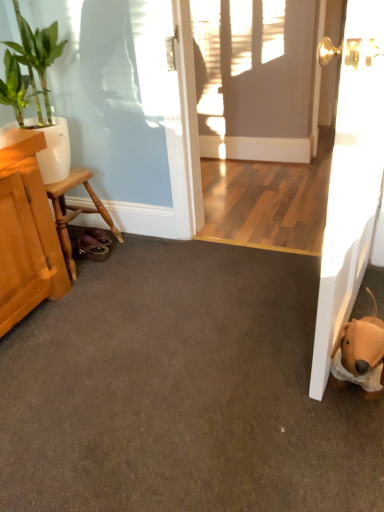
This screenshot has height=512, width=384. I want to click on free space behind white glossy door at right, so click(x=271, y=267).